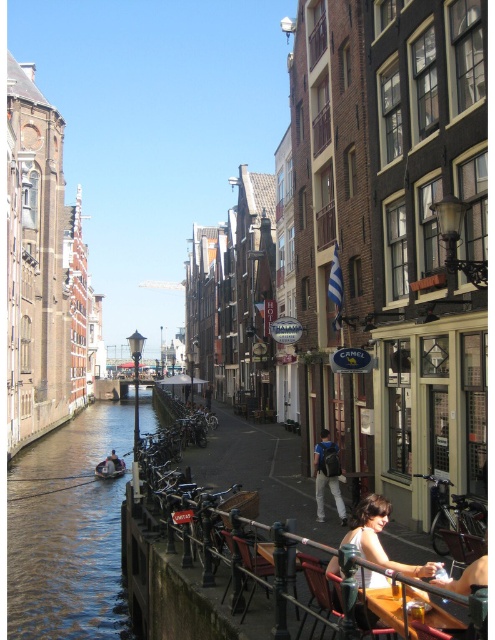
Is clear water at lower left shorter than dark blue backpack at center?

Yes, clear water at lower left is shorter than dark blue backpack at center.

Does point (47, 556) lie in front of point (340, 516)?

No, it is behind (340, 516).

At what (x,y) coordinates should I click in order to perform the action: click on clear water at lower left. Please return your answer as a coordinate pair (x, y). This screenshot has height=640, width=495. Looking at the image, I should click on (68, 531).

The image size is (495, 640). Identify the location of clear water at lower left. (68, 531).

Does light brown hair at lower right have a larger size compared to wooden chair at lower center?

Correct, light brown hair at lower right is larger in size than wooden chair at lower center.

What do you see at coordinates (379, 538) in the screenshot? I see `light brown hair at lower right` at bounding box center [379, 538].

You are a GUI agent. You are given a task and a screenshot of the screen. Output one action in this format:
    pyautogui.click(x=<x>, y=<y>)
    Task: Click on the light brown hair at lower right
    The height and width of the screenshot is (640, 495).
    Given the screenshot: What is the action you would take?
    pyautogui.click(x=379, y=538)

Is clear water at lower left in front of light brown hair at lower right?

No, it is not.

Who is lower down, clear water at lower left or light brown hair at lower right?

clear water at lower left

Between point (15, 520) and point (404, 566), which one is positioned in front?

Point (404, 566) is more forward.

At what (x,y) coordinates should I click in order to perform the action: click on clear water at lower left. Please return your answer as a coordinate pair (x, y). Looking at the image, I should click on (68, 531).